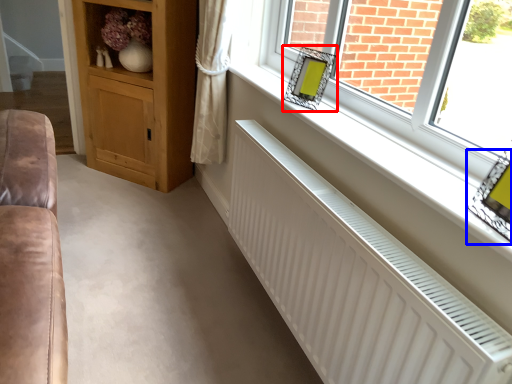
Question: Which object is further to the camera taking this photo, picture frame (highlighted by a red box) or picture frame (highlighted by a blue box)?

Choices:
 (A) picture frame
 (B) picture frame

Answer: (A)